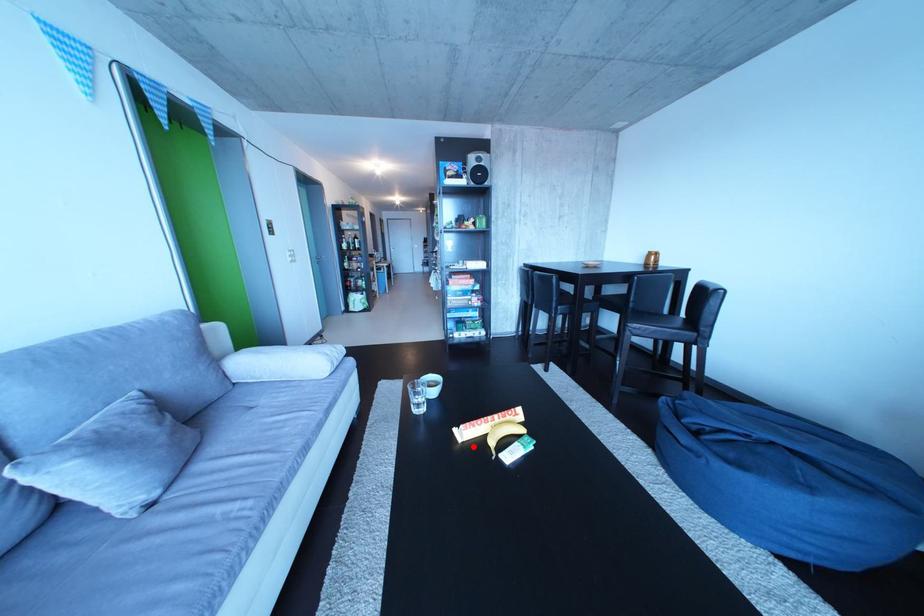
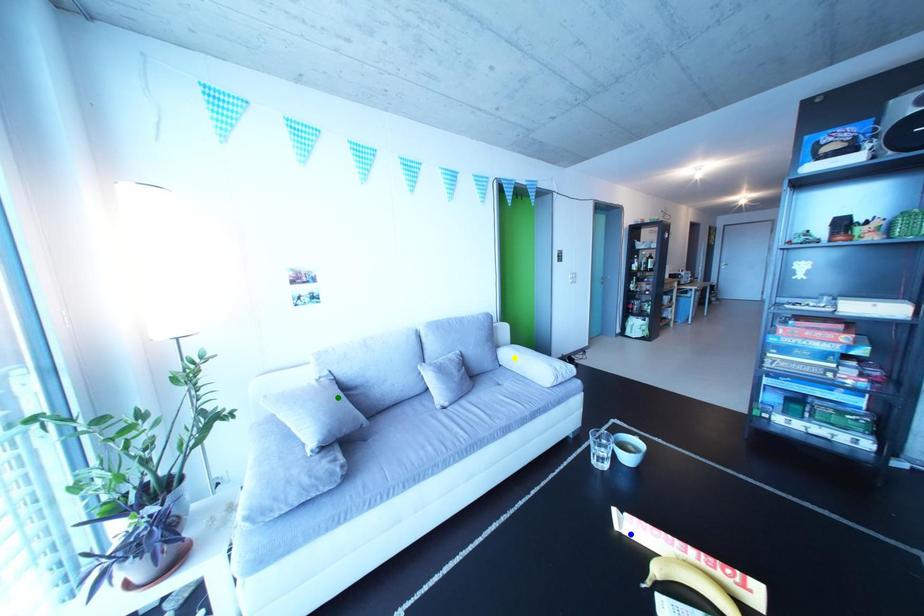
Question: I am providing you with two images of the same scene from different viewpoints. A red point is marked on the first image. You are given multiple points on the second image. Can you choose the point in image 2 that corresponds to the point in image 1?

Choices:
 (A) yellow point
 (B) blue point
 (C) green point

Answer: (B)